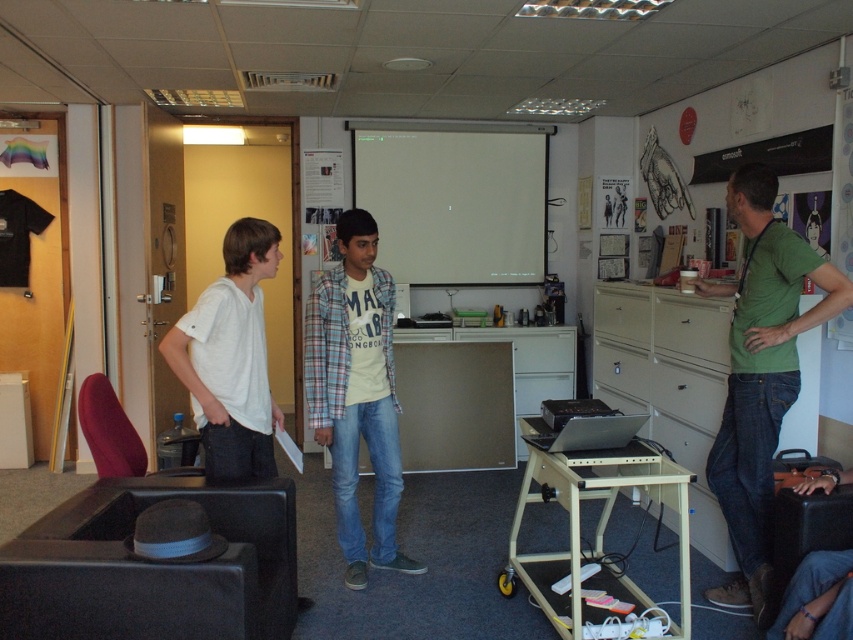
Can you confirm if plaid cotton shirt at center is positioned above white matte shirt at left?

Incorrect, plaid cotton shirt at center is not positioned above white matte shirt at left.

Who is positioned more to the right, plaid cotton shirt at center or white matte shirt at left?

Positioned to the right is plaid cotton shirt at center.

Locate an element on the screen. The width and height of the screenshot is (853, 640). plaid cotton shirt at center is located at coordinates (357, 394).

Who is higher up, green cotton shirt at right or white matte shirt at left?

white matte shirt at left is higher up.

Is green cotton shirt at right bigger than white matte shirt at left?

Indeed, green cotton shirt at right has a larger size compared to white matte shirt at left.

Between point (755, 163) and point (221, 316), which one is positioned in front?

Point (221, 316)

Where is `green cotton shirt at right`? This screenshot has width=853, height=640. green cotton shirt at right is located at coordinates tap(759, 374).

From the picture: Is green cotton shirt at right shorter than plaid cotton shirt at center?

No, green cotton shirt at right is not shorter than plaid cotton shirt at center.

You are a GUI agent. You are given a task and a screenshot of the screen. Output one action in this format:
    pyautogui.click(x=<x>, y=<y>)
    Task: Click on the green cotton shirt at right
    The width and height of the screenshot is (853, 640).
    Given the screenshot: What is the action you would take?
    pyautogui.click(x=759, y=374)

Identify the location of green cotton shirt at right. (759, 374).